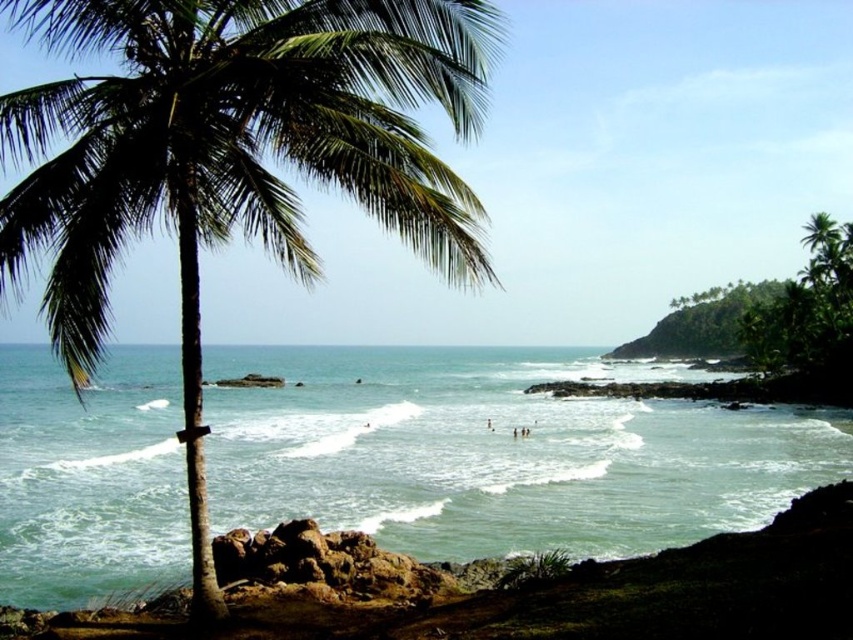
Between green leafy palm tree at left and skinny person at center, which one is positioned higher?

green leafy palm tree at left

Is point (180, 268) farther from viewer compared to point (517, 435)?

No.

Who is more forward, (219, 19) or (511, 433)?

Positioned in front is point (219, 19).

Find the location of a particular element. The image size is (853, 640). green leafy palm tree at left is located at coordinates (231, 154).

Between green leafy palm tree at left and green sand at lower left, which one appears on the left side from the viewer's perspective?

From the viewer's perspective, green leafy palm tree at left appears more on the left side.

Who is shorter, green leafy palm tree at left or green sand at lower left?

green sand at lower left is shorter.

Is point (209, 116) positioned before point (618, 586)?

Yes, it is in front of point (618, 586).

Where is `green leafy palm tree at left`? Image resolution: width=853 pixels, height=640 pixels. green leafy palm tree at left is located at coordinates (231, 154).

Can you confirm if green sand at lower left is taller than skinny person at center?

Indeed, green sand at lower left has a greater height compared to skinny person at center.

Which of these two, green sand at lower left or skinny person at center, stands taller?

With more height is green sand at lower left.

Which is in front, point (291, 550) or point (512, 428)?

Point (291, 550)

You are a GUI agent. You are given a task and a screenshot of the screen. Output one action in this format:
    pyautogui.click(x=<x>, y=<y>)
    Task: Click on the green sand at lower left
    
    Given the screenshot: What is the action you would take?
    pyautogui.click(x=508, y=589)